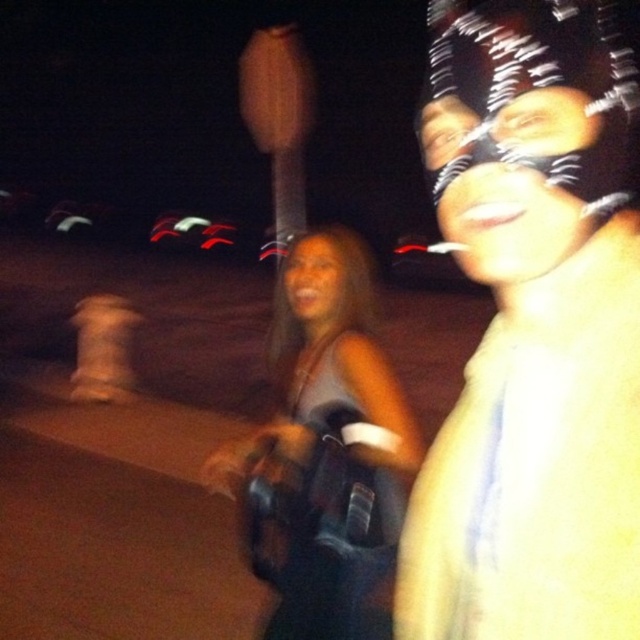
Question: Does satin brown dress at center lie behind matte black mask at upper right?

Choices:
 (A) yes
 (B) no

Answer: (A)

Question: Which point is farther from the camera taking this photo?

Choices:
 (A) (369, 552)
 (B) (472, 488)
 (C) (506, 280)
 (D) (316, 240)

Answer: (D)

Question: Which object is the farthest from the satin brown dress at center?

Choices:
 (A) matte skin tone face at center
 (B) matte black mask at upper right

Answer: (B)

Question: Which of the following is the closest to the observer?

Choices:
 (A) click(x=291, y=269)
 (B) click(x=337, y=250)
 (C) click(x=449, y=141)

Answer: (C)

Question: Can you confirm if matte black mask at upper right is positioned to the right of matte skin tone face at center?

Choices:
 (A) no
 (B) yes

Answer: (B)

Question: Can you confirm if shiny metallic face mask at center is thinner than matte skin tone face at center?

Choices:
 (A) yes
 (B) no

Answer: (B)